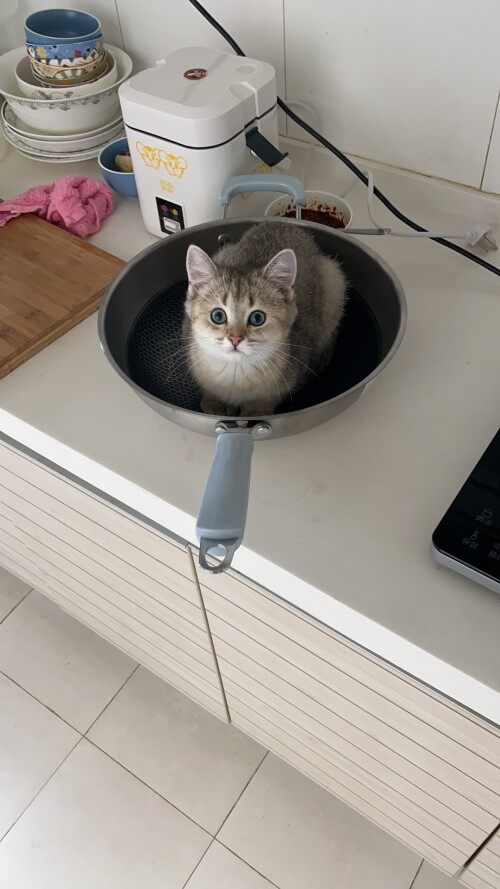
Where is `cutting board`? cutting board is located at coordinates (37, 276).